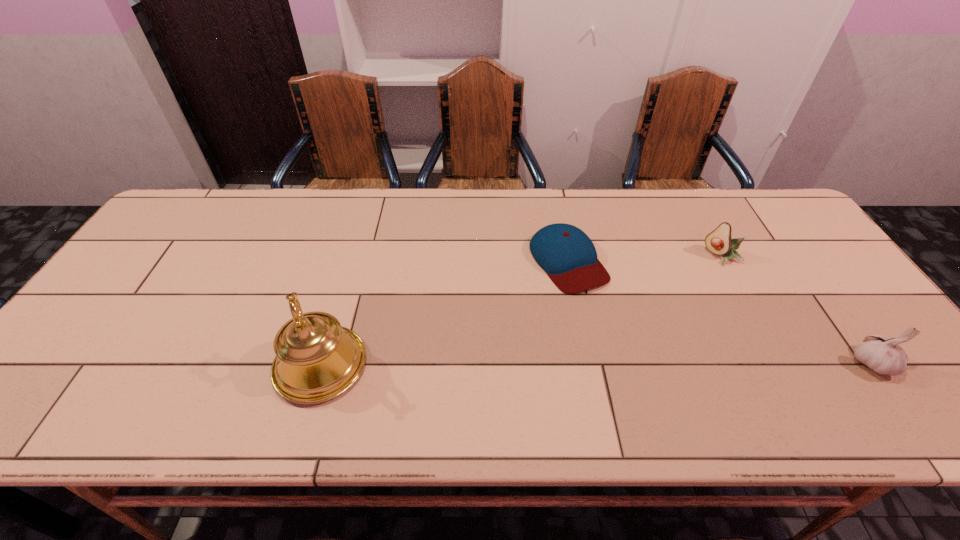
In order to click on unoccupied area between the second object from left to right and the garlic in this screenshot , I will do `click(719, 312)`.

Where is `free space between the tallest object and the rightmost object`? The width and height of the screenshot is (960, 540). free space between the tallest object and the rightmost object is located at coordinates (595, 364).

The image size is (960, 540). In order to click on empty location between the shortest object and the rightmost object in this screenshot , I will do `click(719, 312)`.

Select which object is the closest to the garlic. Please provide its 2D coordinates. Your answer should be formatted as a tuple, i.e. [(x, y)], where the tuple contains the x and y coordinates of a point satisfying the conditions above.

[(719, 241)]

At what (x,y) coordinates should I click in order to perform the action: click on the closest object to the leftmost object. Please return your answer as a coordinate pair (x, y). The image size is (960, 540). Looking at the image, I should click on (568, 256).

I want to click on free space in the image that satisfies the following two spatial constraints: 1. on the front side of the rightmost object; 2. on the right side of the third object from left to right, so click(780, 362).

You are a GUI agent. You are given a task and a screenshot of the screen. Output one action in this format:
    pyautogui.click(x=<x>, y=<y>)
    Task: Click on the free space that satisfies the following two spatial constraints: 1. on the back side of the second object from right to left; 2. on the left side of the tallest object
    This screenshot has width=960, height=540.
    Given the screenshot: What is the action you would take?
    pyautogui.click(x=352, y=256)

The width and height of the screenshot is (960, 540). I want to click on vacant space that satisfies the following two spatial constraints: 1. on the back side of the second object from left to right; 2. on the left side of the leftmost object, so 351,261.

Find the location of a particular element. vacant space that satisfies the following two spatial constraints: 1. on the front side of the garlic; 2. on the left side of the shortest object is located at coordinates (588, 362).